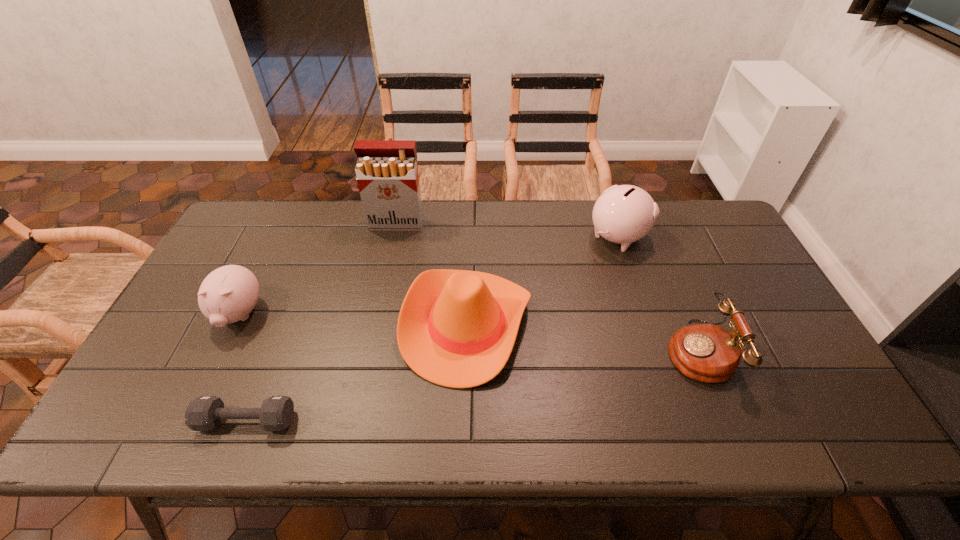
This screenshot has width=960, height=540. Identify the location of object that is at the left edge. (228, 294).

Image resolution: width=960 pixels, height=540 pixels. In order to click on free space at the far edge of the desktop in this screenshot , I will do `click(486, 233)`.

The width and height of the screenshot is (960, 540). Identify the location of free spot at the near edge of the desktop. (301, 413).

In the image, there is a desktop. What are the coordinates of `vacant space at the right edge` in the screenshot? It's located at (797, 355).

What are the coordinates of `vacant space at the far left corner` in the screenshot? It's located at (279, 208).

The image size is (960, 540). In the image, there is a desktop. Find the location of `vacant space at the near left corner`. vacant space at the near left corner is located at coordinates (162, 417).

Where is `empty space that is in between the cigarette case and the right piggy bank`? Image resolution: width=960 pixels, height=540 pixels. empty space that is in between the cigarette case and the right piggy bank is located at coordinates pyautogui.click(x=507, y=230).

At what (x,y) coordinates should I click in order to perform the action: click on vacant space that is in between the tallest object and the shortest object. Please return your answer as a coordinate pair (x, y). The height and width of the screenshot is (540, 960). Looking at the image, I should click on (322, 322).

This screenshot has width=960, height=540. Find the location of `free point between the cowboy hat and the nearest object`. free point between the cowboy hat and the nearest object is located at coordinates (357, 373).

Image resolution: width=960 pixels, height=540 pixels. I want to click on free space between the telephone and the tallest object, so click(547, 287).